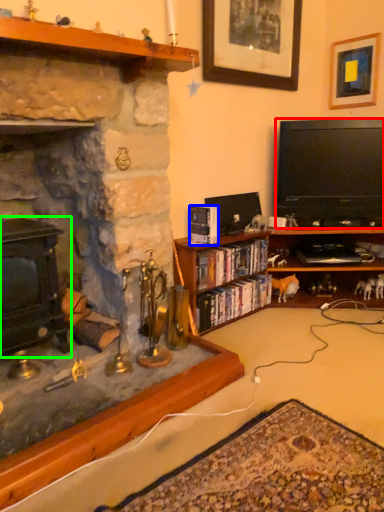
Question: Considering the real-world distances, which object is farthest from television (highlighted by a red box)? book (highlighted by a blue box) or fireplace (highlighted by a green box)?

Choices:
 (A) book
 (B) fireplace

Answer: (B)